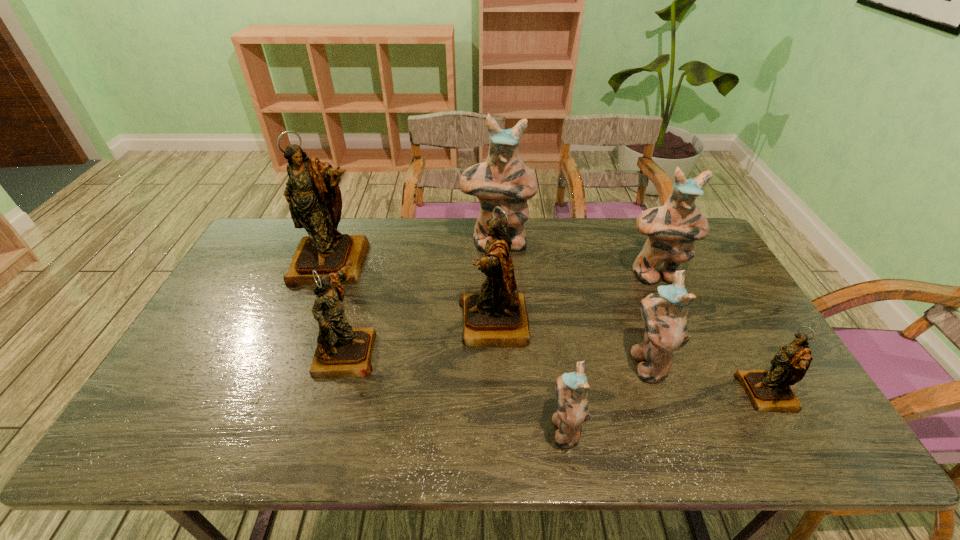
Where is `free spot located 0.150m on the front-facing side of the third nearest pink figurine`? The width and height of the screenshot is (960, 540). free spot located 0.150m on the front-facing side of the third nearest pink figurine is located at coordinates (677, 324).

At what (x,y) coordinates should I click in order to perform the action: click on vacant area located on the front-facing side of the second gold figurine from right to left. Please return your answer as a coordinate pair (x, y). Image resolution: width=960 pixels, height=540 pixels. Looking at the image, I should click on (417, 323).

Locate an element on the screen. blank area located 0.090m on the front-facing side of the second gold figurine from right to left is located at coordinates (427, 323).

Where is `free space located 0.170m on the front-facing side of the second gold figurine from right to left`? This screenshot has height=540, width=960. free space located 0.170m on the front-facing side of the second gold figurine from right to left is located at coordinates (398, 323).

Find the location of `free space located on the front-facing side of the second smallest gold figurine`. free space located on the front-facing side of the second smallest gold figurine is located at coordinates (444, 351).

This screenshot has width=960, height=540. I want to click on vacant space positioned 0.360m on the front-facing side of the second nearest pink figurine, so click(x=492, y=362).

Locate an element on the screen. This screenshot has width=960, height=540. vacant space located on the front-facing side of the second nearest pink figurine is located at coordinates (489, 362).

Where is `blank area located on the front-facing side of the second nearest pink figurine`? The height and width of the screenshot is (540, 960). blank area located on the front-facing side of the second nearest pink figurine is located at coordinates (549, 362).

Locate an element on the screen. free space located 0.240m on the front-facing side of the smallest gold figurine is located at coordinates (645, 393).

Locate an element on the screen. Image resolution: width=960 pixels, height=540 pixels. vacant space located on the front-facing side of the smallest gold figurine is located at coordinates (585, 393).